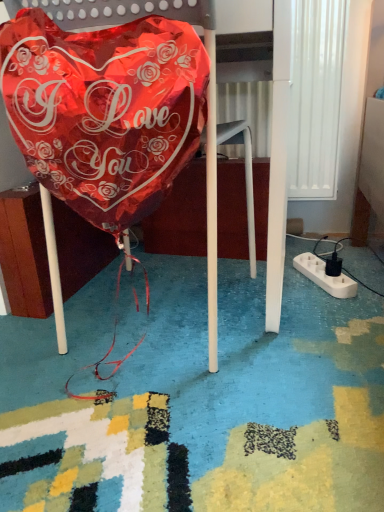
Where is `free spot below shiny metallic balloon at left (from a real-world perspective)`? Image resolution: width=384 pixels, height=512 pixels. free spot below shiny metallic balloon at left (from a real-world perspective) is located at coordinates (60, 395).